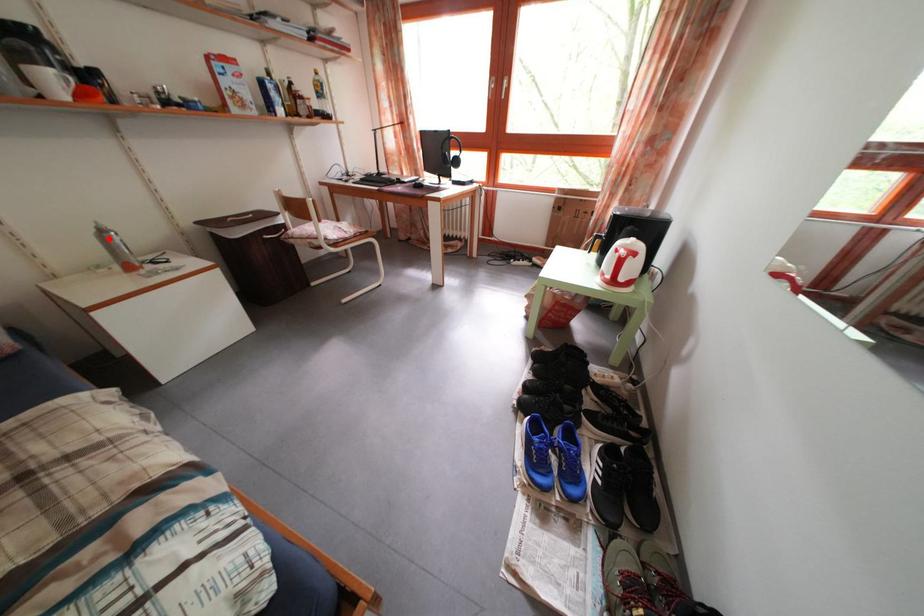
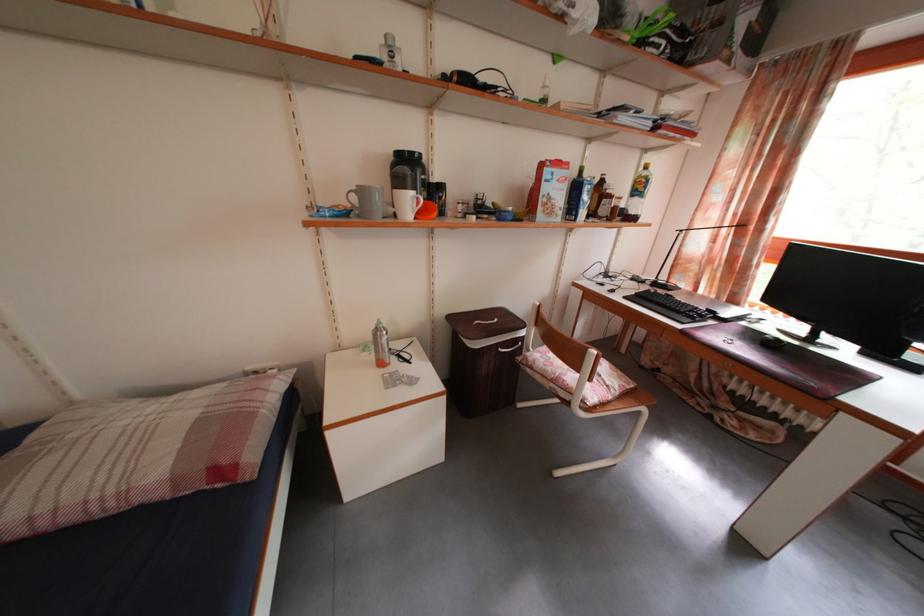
Question: A red point is marked in image1. In image2, is the corresponding 3D point closer to the camera or farther? Reply with the corresponding letter.

Choices:
 (A) The corresponding 3D point is closer.
 (B) The corresponding 3D point is farther.

Answer: (A)